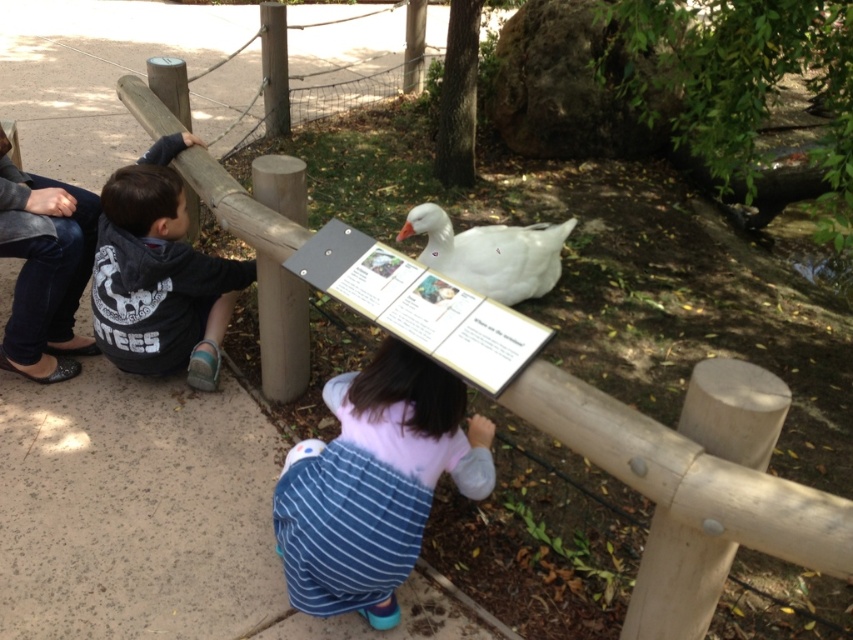
Question: Which of the following is the closest to the observer?

Choices:
 (A) striped denim dress at center
 (B) dark gray hoodie at left

Answer: (A)

Question: Where is striped denim dress at center located in relation to white matte duck at center in the image?

Choices:
 (A) left
 (B) right

Answer: (A)

Question: Is striped denim dress at center to the right of dark gray hoodie at left from the viewer's perspective?

Choices:
 (A) no
 (B) yes

Answer: (B)

Question: Which of these objects is positioned closest to the striped denim dress at center?

Choices:
 (A) white matte duck at center
 (B) dark gray hoodie at left

Answer: (B)

Question: Does striped denim dress at center appear on the left side of dark gray hoodie at left?

Choices:
 (A) yes
 (B) no

Answer: (B)

Question: Based on their relative distances, which object is nearer to the striped denim dress at center?

Choices:
 (A) dark gray hoodie at left
 (B) white matte duck at center

Answer: (A)